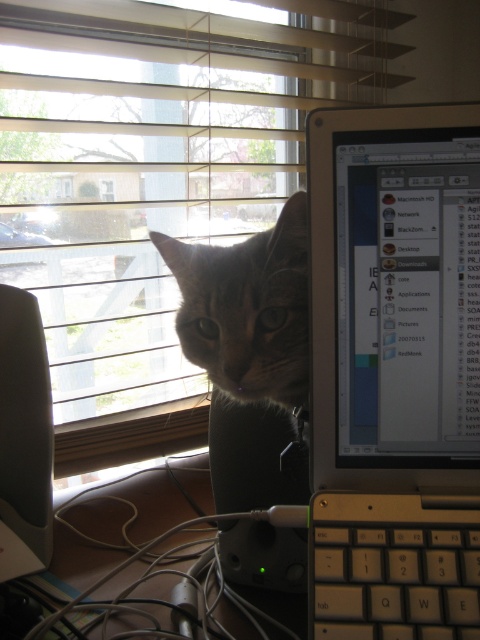
Does white plastic laptop at right appear under satin black monitor at left?

Incorrect, white plastic laptop at right is not positioned below satin black monitor at left.

Which is more to the left, white plastic laptop at right or satin black monitor at left?

Positioned to the left is satin black monitor at left.

Does point (316, 428) come in front of point (31, 449)?

Yes, point (316, 428) is in front of point (31, 449).

Locate an element on the screen. The height and width of the screenshot is (640, 480). white plastic laptop at right is located at coordinates (395, 372).

Who is more distant from viewer, [457,250] or [255,241]?

Point [255,241]

Is white plastic laptop at right to the right of tabby fur cat at center from the viewer's perspective?

Indeed, white plastic laptop at right is positioned on the right side of tabby fur cat at center.

The height and width of the screenshot is (640, 480). Identify the location of white plastic laptop at right. (395, 372).

Does white plastic laptop at right appear under silver metallic keyboard at lower right?

No, white plastic laptop at right is not below silver metallic keyboard at lower right.

Is white plastic laptop at right wider than silver metallic keyboard at lower right?

Indeed, white plastic laptop at right has a greater width compared to silver metallic keyboard at lower right.

What are the coordinates of `white plastic laptop at right` in the screenshot? It's located at (395, 372).